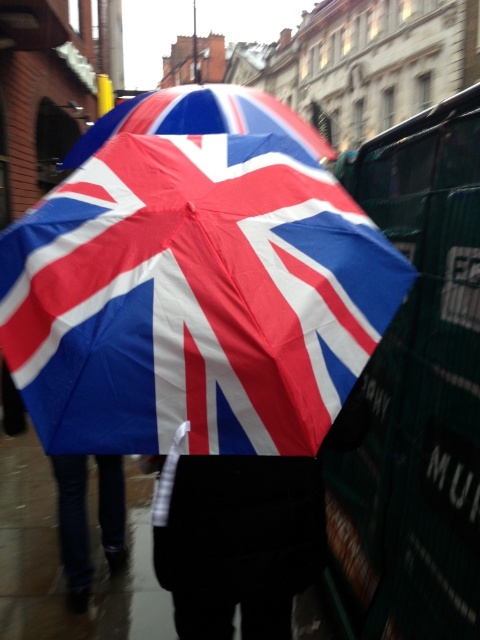
Is polyester umbrella at center smaller than matte plastic umbrella at center?

Indeed, polyester umbrella at center has a smaller size compared to matte plastic umbrella at center.

Is polyester umbrella at center closer to camera compared to matte plastic umbrella at center?

Yes.

Does point (309, 262) come farther from viewer compared to point (257, 100)?

No, (309, 262) is closer to viewer.

The width and height of the screenshot is (480, 640). Find the location of `polyester umbrella at center`. polyester umbrella at center is located at coordinates (193, 298).

Who is positioned more to the right, polyester umbrella at center or velvet black coat at center?

velvet black coat at center

Is point (208, 200) closer to camera compared to point (217, 490)?

Yes.

Which is in front, point (338, 317) or point (253, 474)?

Point (338, 317)

The image size is (480, 640). Identify the location of polyester umbrella at center. (193, 298).

Which is more to the left, matte plastic umbrella at center or jeans at lower left?

From the viewer's perspective, jeans at lower left appears more on the left side.

Measure the distance between point (x=254, y=100) and camera.

Point (x=254, y=100) and camera are 3.15 meters apart.

Is point (81, 134) positioned in front of point (115, 520)?

No, (81, 134) is behind (115, 520).

Locate an element on the screen. matte plastic umbrella at center is located at coordinates (203, 120).